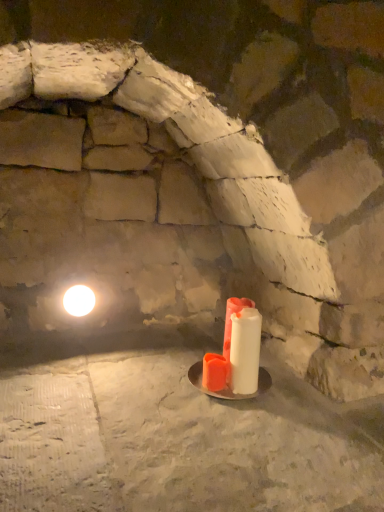
Question: Is white glossy light at upper left with white matte candle at center?

Choices:
 (A) no
 (B) yes

Answer: (A)

Question: Is white glossy light at upper left located outside white matte candle at center?

Choices:
 (A) no
 (B) yes

Answer: (B)

Question: Considering the relative sizes of white glossy light at upper left and white matte candle at center in the image provided, is white glossy light at upper left wider than white matte candle at center?

Choices:
 (A) yes
 (B) no

Answer: (A)

Question: Can you confirm if white glossy light at upper left is thinner than white matte candle at center?

Choices:
 (A) yes
 (B) no

Answer: (B)

Question: Is white glossy light at upper left bigger than white matte candle at center?

Choices:
 (A) yes
 (B) no

Answer: (B)

Question: Is white glossy light at upper left taller than white matte candle at center?

Choices:
 (A) no
 (B) yes

Answer: (A)

Question: Is white matte candle at center to the right of white glossy light at upper left from the viewer's perspective?

Choices:
 (A) yes
 (B) no

Answer: (A)

Question: Is white matte candle at center not inside white glossy light at upper left?

Choices:
 (A) no
 (B) yes

Answer: (B)

Question: Considering the relative sizes of white matte candle at center and white glossy light at upper left in the image provided, is white matte candle at center taller than white glossy light at upper left?

Choices:
 (A) no
 (B) yes

Answer: (B)

Question: Is white matte candle at center to the left of white glossy light at upper left from the viewer's perspective?

Choices:
 (A) no
 (B) yes

Answer: (A)

Question: Could white glossy light at upper left be considered to be inside white matte candle at center?

Choices:
 (A) no
 (B) yes

Answer: (A)

Question: Can you confirm if white matte candle at center is shorter than white glossy light at upper left?

Choices:
 (A) yes
 (B) no

Answer: (B)

Question: Is white matte candle at center taller or shorter than white glossy light at upper left?

Choices:
 (A) tall
 (B) short

Answer: (A)